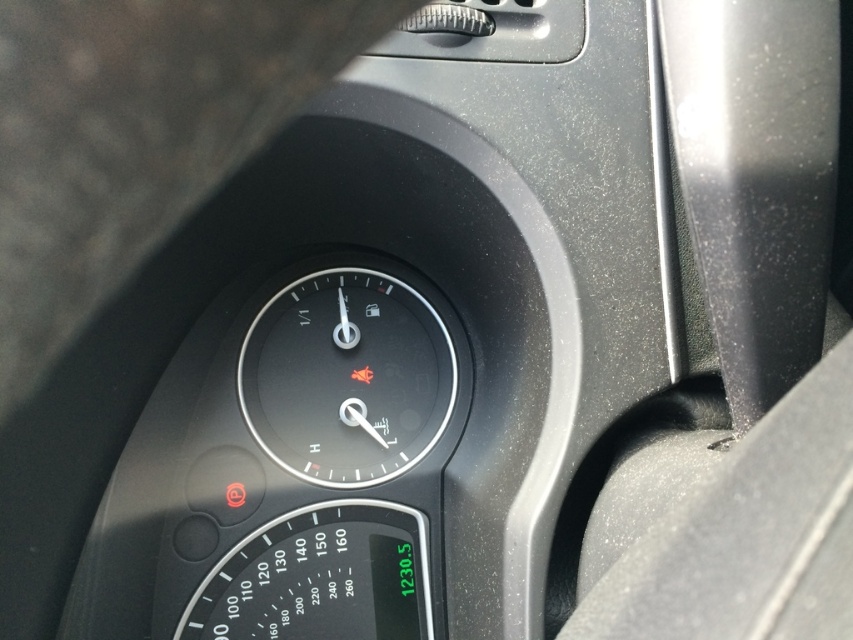
Looking at this image, can you confirm if black matte speedometer at center is bigger than black plastic speedometer at lower center?

No, black matte speedometer at center is not bigger than black plastic speedometer at lower center.

Who is shorter, black matte speedometer at center or black plastic speedometer at lower center?

black plastic speedometer at lower center

Identify the location of black matte speedometer at center. (347, 378).